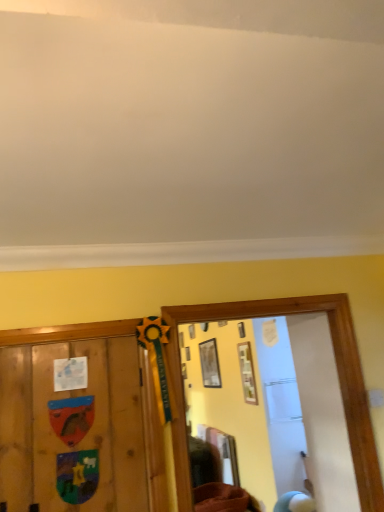
The width and height of the screenshot is (384, 512). What do you see at coordinates (241, 329) in the screenshot?
I see `matte wooden picture frame at upper center, acting as the 2th picture frame starting from the front` at bounding box center [241, 329].

How much space does matte white picture frame at center, the 3th picture frame in the back-to-front sequence, occupy horizontally?

It is 1.58 inches.

Find the location of a particular element. brown fabric at lower center is located at coordinates (220, 498).

Where is `furniture below the matte white picture frame at center, the third picture frame from the left (from a real-world perspective)`? Image resolution: width=384 pixels, height=512 pixels. furniture below the matte white picture frame at center, the third picture frame from the left (from a real-world perspective) is located at coordinates (220, 498).

From a real-world perspective, does brown fabric at lower center stand above matte white picture frame at center, the third picture frame from the left?

No, from a real-world perspective, brown fabric at lower center is not above matte white picture frame at center, the third picture frame from the left.

What's the angular difference between brown fabric at lower center and matte white picture frame at center, the third picture frame from the left,'s facing directions?

0.0105 degrees.

Considering the relative sizes of brown fabric at lower center and matte white picture frame at center, the 3th picture frame in the back-to-front sequence, in the image provided, is brown fabric at lower center thinner than matte white picture frame at center, the 3th picture frame in the back-to-front sequence,?

In fact, brown fabric at lower center might be wider than matte white picture frame at center, the 3th picture frame in the back-to-front sequence.

From a real-world perspective, does brown fabric at lower center sit lower than matte wooden picture frame at upper center, which is the 2th picture frame from back to front?

Yes, from a real-world perspective, brown fabric at lower center is under matte wooden picture frame at upper center, which is the 2th picture frame from back to front.

Based on the photo, which point is more distant from viewer, (x=241, y=493) or (x=240, y=326)?

The point (x=240, y=326) is behind.

From the picture: Considering the relative sizes of brown fabric at lower center and matte wooden picture frame at upper center, acting as the 2th picture frame starting from the front, in the image provided, is brown fabric at lower center shorter than matte wooden picture frame at upper center, acting as the 2th picture frame starting from the front,?

In fact, brown fabric at lower center may be taller than matte wooden picture frame at upper center, acting as the 2th picture frame starting from the front.

Consider the image. From a real-world perspective, who is located higher, wooden picture frame at upper center, the 3th picture frame from the right, or matte white picture frame at center, arranged as the 1th picture frame when viewed from the right?

wooden picture frame at upper center, the 3th picture frame from the right, from a real-world perspective.

Which object is closer to the camera, wooden picture frame at upper center, positioned as the 3th picture frame in front-to-back order, or matte white picture frame at center, which is the 1th picture frame from front to back?

matte white picture frame at center, which is the 1th picture frame from front to back, is more forward.

Can you confirm if wooden picture frame at upper center, the 3th picture frame from the right, is shorter than matte white picture frame at center, arranged as the 1th picture frame when viewed from the right?

No, wooden picture frame at upper center, the 3th picture frame from the right, is not shorter than matte white picture frame at center, arranged as the 1th picture frame when viewed from the right.

Is matte white picture frame at center, arranged as the 1th picture frame when viewed from the right, surrounded by wooden picture frame at upper center, which is counted as the 1th picture frame, starting from the back?

No, matte white picture frame at center, arranged as the 1th picture frame when viewed from the right, is not surrounded by wooden picture frame at upper center, which is counted as the 1th picture frame, starting from the back.

Is wooden picture frame at upper center, the 3th picture frame from the right, positioned in front of brown fabric at lower center?

No, wooden picture frame at upper center, the 3th picture frame from the right, is further to the viewer.

Can you confirm if wooden picture frame at upper center, positioned as the 3th picture frame in front-to-back order, is bigger than brown fabric at lower center?

Incorrect, wooden picture frame at upper center, positioned as the 3th picture frame in front-to-back order, is not larger than brown fabric at lower center.

Is wooden picture frame at upper center, the 3th picture frame from the right, not near brown fabric at lower center?

That's right, there is a large distance between wooden picture frame at upper center, the 3th picture frame from the right, and brown fabric at lower center.

From their relative heights in the image, would you say wooden picture frame at upper center, which is counted as the 1th picture frame, starting from the back, is taller or shorter than brown fabric at lower center?

In the image, wooden picture frame at upper center, which is counted as the 1th picture frame, starting from the back, appears to be taller than brown fabric at lower center.

Looking at their sizes, would you say matte wooden picture frame at upper center, which is the second picture frame in right-to-left order, is wider or thinner than matte white picture frame at center, arranged as the 1th picture frame when viewed from the right?

Clearly, matte wooden picture frame at upper center, which is the second picture frame in right-to-left order, has less width compared to matte white picture frame at center, arranged as the 1th picture frame when viewed from the right.

How many degrees apart are the facing directions of matte wooden picture frame at upper center, acting as the 2th picture frame starting from the front, and matte white picture frame at center, the 3th picture frame in the back-to-front sequence?

0.00897 degrees separate the facing orientations of matte wooden picture frame at upper center, acting as the 2th picture frame starting from the front, and matte white picture frame at center, the 3th picture frame in the back-to-front sequence.

Do you think matte wooden picture frame at upper center, which is the 2th picture frame from back to front, is within matte white picture frame at center, the 3th picture frame in the back-to-front sequence, or outside of it?

matte wooden picture frame at upper center, which is the 2th picture frame from back to front, is not inside matte white picture frame at center, the 3th picture frame in the back-to-front sequence, it's outside.

Between matte wooden picture frame at upper center, positioned as the second picture frame in left-to-right order, and matte white picture frame at center, the third picture frame from the left, which one is positioned in front?

matte white picture frame at center, the third picture frame from the left, is more forward.

Which object is more forward, matte wooden picture frame at upper center, which is the 2th picture frame from back to front, or wooden picture frame at upper center, which appears as the 1th picture frame when viewed from the left?

matte wooden picture frame at upper center, which is the 2th picture frame from back to front, is more forward.

Is matte wooden picture frame at upper center, which is the 2th picture frame from back to front, thinner than wooden picture frame at upper center, the 3th picture frame from the right?

Yes, matte wooden picture frame at upper center, which is the 2th picture frame from back to front, is thinner than wooden picture frame at upper center, the 3th picture frame from the right.

What's the angular difference between matte wooden picture frame at upper center, which is the 2th picture frame from back to front, and wooden picture frame at upper center, positioned as the 3th picture frame in front-to-back order,'s facing directions?

The angular difference between matte wooden picture frame at upper center, which is the 2th picture frame from back to front, and wooden picture frame at upper center, positioned as the 3th picture frame in front-to-back order, is 0.0264 degrees.

In the scene shown: Who is shorter, matte wooden picture frame at upper center, which is the 2th picture frame from back to front, or wooden picture frame at upper center, positioned as the 3th picture frame in front-to-back order?

matte wooden picture frame at upper center, which is the 2th picture frame from back to front.

Is matte white picture frame at center, which is the 1th picture frame from front to back, positioned with its back to matte wooden picture frame at upper center, acting as the 2th picture frame starting from the front?

matte white picture frame at center, which is the 1th picture frame from front to back, is not turned away from matte wooden picture frame at upper center, acting as the 2th picture frame starting from the front.

Is matte white picture frame at center, the 3th picture frame in the back-to-front sequence, beside matte wooden picture frame at upper center, which is the second picture frame in right-to-left order?

No, matte white picture frame at center, the 3th picture frame in the back-to-front sequence, is not next to matte wooden picture frame at upper center, which is the second picture frame in right-to-left order.

Between matte white picture frame at center, which is the 1th picture frame from front to back, and matte wooden picture frame at upper center, acting as the 2th picture frame starting from the front, which one has more height?

matte white picture frame at center, which is the 1th picture frame from front to back, is taller.

The height and width of the screenshot is (512, 384). Find the location of `the 2nd picture frame above the brown fabric at lower center (from the image's perspective)`. the 2nd picture frame above the brown fabric at lower center (from the image's perspective) is located at coordinates coord(247,373).

From the brown fabric at lower center, count 1st picture frame to the right and point to it. Please provide its 2D coordinates.

[(241, 329)]

From the image, which object appears to be farther from matte white picture frame at center, the third picture frame from the left, matte wooden picture frame at upper center, acting as the 2th picture frame starting from the front, or brown fabric at lower center?

brown fabric at lower center.

Considering their positions, is brown fabric at lower center positioned further to matte white picture frame at center, arranged as the 1th picture frame when viewed from the right, than matte wooden picture frame at upper center, which is the 2th picture frame from back to front?

Based on the image, brown fabric at lower center appears to be further to matte white picture frame at center, arranged as the 1th picture frame when viewed from the right.

Based on their spatial positions, is wooden picture frame at upper center, which appears as the 1th picture frame when viewed from the left, or matte white picture frame at center, arranged as the 1th picture frame when viewed from the right, further from brown fabric at lower center?

wooden picture frame at upper center, which appears as the 1th picture frame when viewed from the left, is further to brown fabric at lower center.

Looking at this image, estimate the real-world distances between objects in this image. Which object is further from matte white picture frame at center, the third picture frame from the left, matte wooden picture frame at upper center, positioned as the second picture frame in left-to-right order, or wooden picture frame at upper center, the 3th picture frame from the right?

The object further to matte white picture frame at center, the third picture frame from the left, is wooden picture frame at upper center, the 3th picture frame from the right.

Based on their spatial positions, is matte white picture frame at center, which is the 1th picture frame from front to back, or brown fabric at lower center further from wooden picture frame at upper center, which appears as the 1th picture frame when viewed from the left?

brown fabric at lower center is further to wooden picture frame at upper center, which appears as the 1th picture frame when viewed from the left.

Estimate the real-world distances between objects in this image. Which object is closer to matte white picture frame at center, the third picture frame from the left, brown fabric at lower center or wooden picture frame at upper center, which is counted as the 1th picture frame, starting from the back?

wooden picture frame at upper center, which is counted as the 1th picture frame, starting from the back, is positioned closer to the anchor matte white picture frame at center, the third picture frame from the left.

Based on their spatial positions, is matte wooden picture frame at upper center, positioned as the second picture frame in left-to-right order, or brown fabric at lower center further from wooden picture frame at upper center, which is counted as the 1th picture frame, starting from the back?

brown fabric at lower center lies further to wooden picture frame at upper center, which is counted as the 1th picture frame, starting from the back, than the other object.

Based on their spatial positions, is matte white picture frame at center, which is the 1th picture frame from front to back, or wooden picture frame at upper center, which appears as the 1th picture frame when viewed from the left, closer to matte wooden picture frame at upper center, which is the second picture frame in right-to-left order?

The object closer to matte wooden picture frame at upper center, which is the second picture frame in right-to-left order, is matte white picture frame at center, which is the 1th picture frame from front to back.

Find the location of `picture frame between matte white picture frame at center, the third picture frame from the left, and brown fabric at lower center vertically`. picture frame between matte white picture frame at center, the third picture frame from the left, and brown fabric at lower center vertically is located at coordinates (210, 364).

Locate an element on the screen. Image resolution: width=384 pixels, height=512 pixels. picture frame between matte white picture frame at center, the 3th picture frame in the back-to-front sequence, and wooden picture frame at upper center, positioned as the 3th picture frame in front-to-back order, along the z-axis is located at coordinates (241, 329).